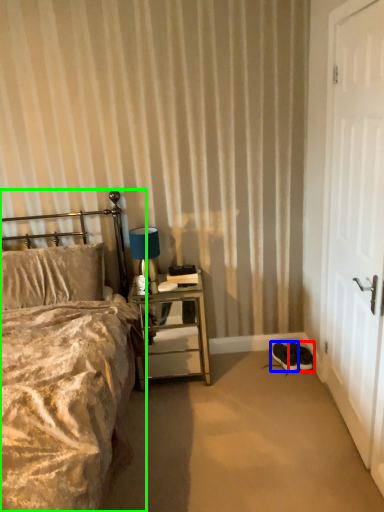
Question: Which object is positioned closest to footwear (highlighted by a red box)? Select from footwear (highlighted by a blue box) and bed (highlighted by a green box).

Choices:
 (A) footwear
 (B) bed

Answer: (A)